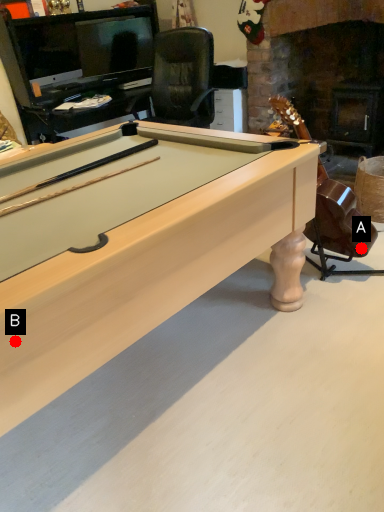
Question: Two points are circled on the image, labeled by A and B beside each circle. Which point is farther from the camera taking this photo?

Choices:
 (A) A is further
 (B) B is further

Answer: (A)